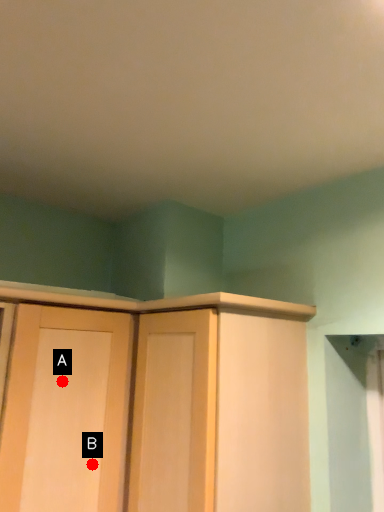
Question: Two points are circled on the image, labeled by A and B beside each circle. Which point appears closest to the camera in this image?

Choices:
 (A) A is closer
 (B) B is closer

Answer: (A)